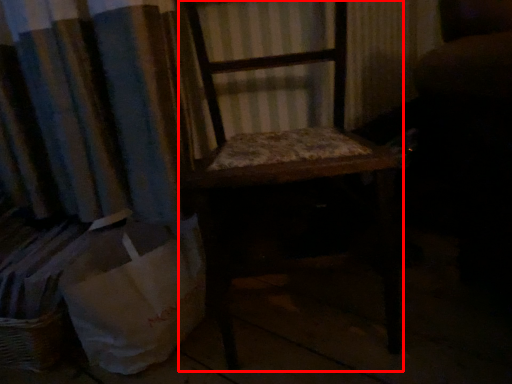
Question: From the image's perspective, where is furniture (annotated by the red box) located relative to shopping bag?

Choices:
 (A) above
 (B) below

Answer: (A)